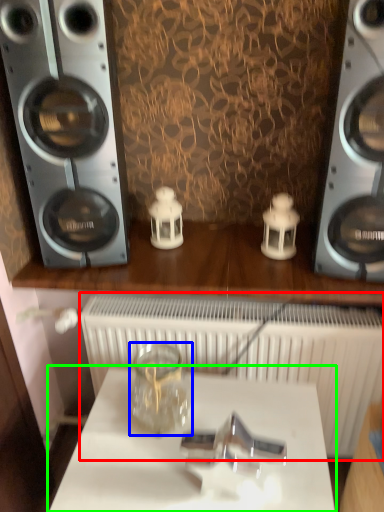
Question: Considering the real-world distances, which object is closest to radiator (highlighted by a red box)? glass jar (highlighted by a blue box) or table (highlighted by a green box).

Choices:
 (A) glass jar
 (B) table

Answer: (A)